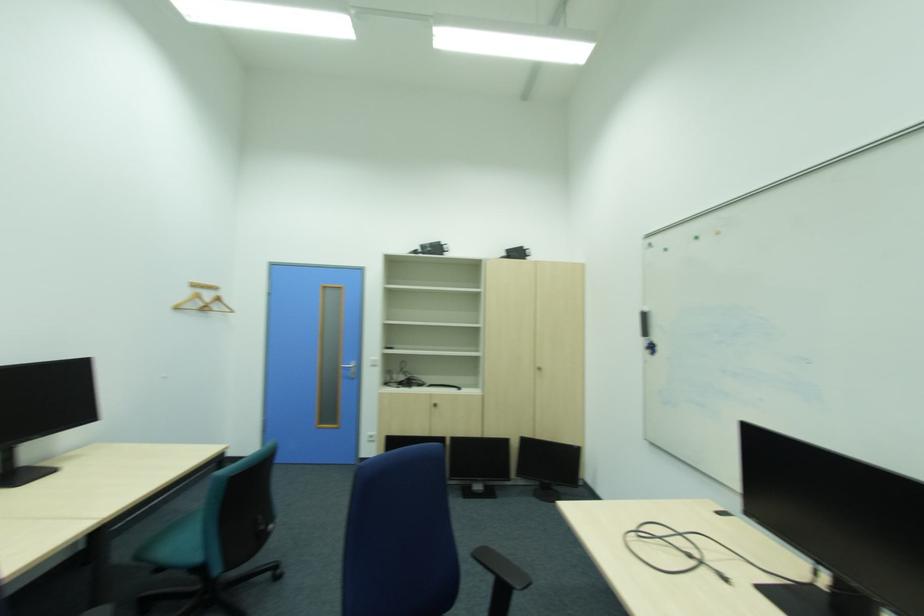
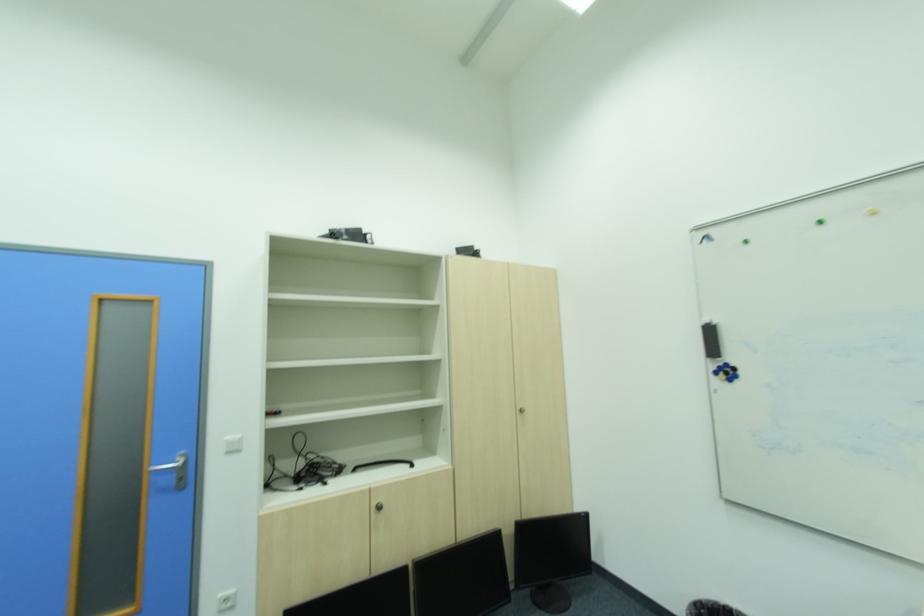
Where in the second image is the point corresponding to point 381,361 from the first image?

(237, 443)